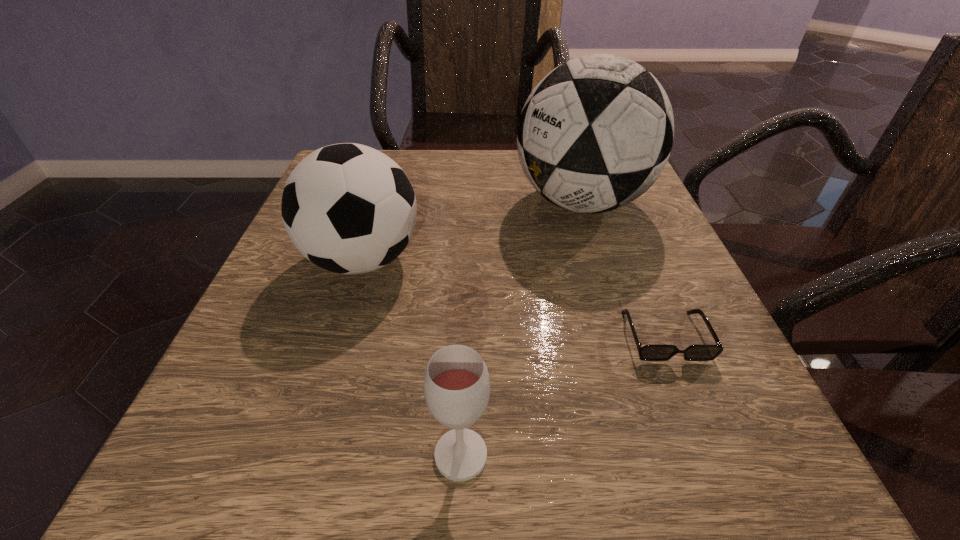
Where is `vacant space located on the surface of the taller soccer ball where the brand logo is visible`? vacant space located on the surface of the taller soccer ball where the brand logo is visible is located at coordinates (339, 202).

The width and height of the screenshot is (960, 540). What are the coordinates of `vacant space located 0.260m on the right of the second tallest object` in the screenshot? It's located at (570, 260).

Where is `vacant area located 0.120m on the left of the wineglass`? Image resolution: width=960 pixels, height=540 pixels. vacant area located 0.120m on the left of the wineglass is located at coordinates (330, 455).

The height and width of the screenshot is (540, 960). Identify the location of vacant space located on the front-facing side of the second nearest object. (717, 465).

Find the location of a particular element. object that is positioned at the far edge is located at coordinates (595, 133).

Locate an element on the screen. object that is at the near edge is located at coordinates (456, 384).

Locate an element on the screen. This screenshot has height=540, width=960. object that is at the left edge is located at coordinates point(348,208).

You are a GUI agent. You are given a task and a screenshot of the screen. Output one action in this format:
    pyautogui.click(x=<x>, y=<y>)
    Task: Click on the soccer ball that is at the right edge
    Image resolution: width=960 pixels, height=540 pixels.
    Given the screenshot: What is the action you would take?
    pyautogui.click(x=595, y=133)

Find the location of a particular element. sunglasses that is at the right edge is located at coordinates (655, 352).

At what (x,y) coordinates should I click in order to perform the action: click on object that is at the far right corner. Please return your answer as a coordinate pair (x, y). The width and height of the screenshot is (960, 540). Looking at the image, I should click on (595, 133).